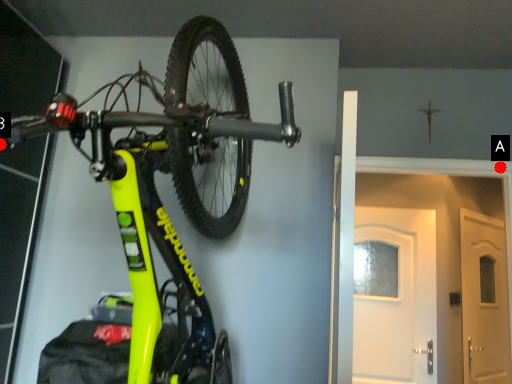
Question: Two points are circled on the image, labeled by A and B beside each circle. Which point is farther from the camera taking this photo?

Choices:
 (A) A is further
 (B) B is further

Answer: (A)